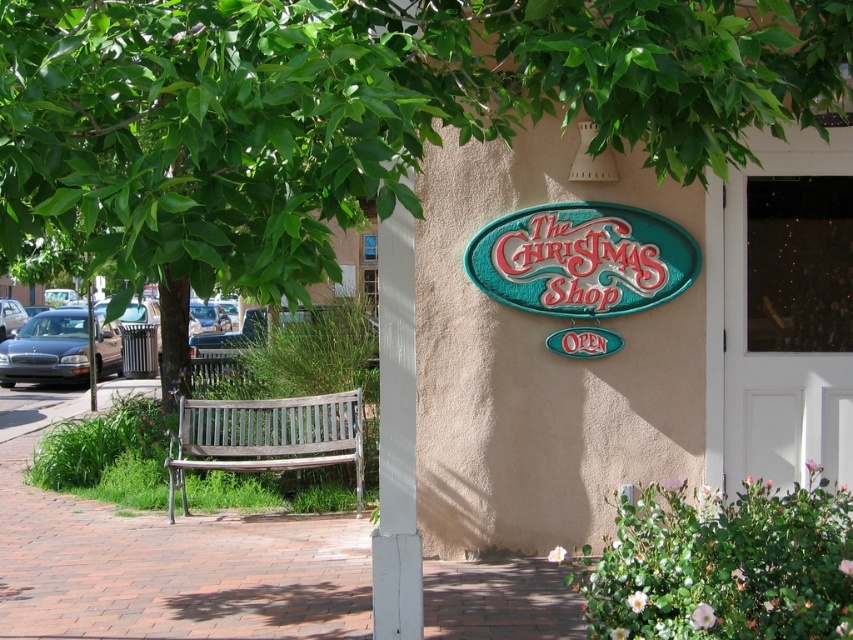
Question: Is white wooden door at right smaller than matte dark gray sedan at left?

Choices:
 (A) no
 (B) yes

Answer: (B)

Question: Which object is positioned closest to the matte dark gray sedan at left?

Choices:
 (A) green leafy tree at upper left
 (B) teal glossy sign at center
 (C) white wooden door at right
 (D) wooden bench at center

Answer: (D)

Question: Which point is farther to the camera?

Choices:
 (A) (318, 436)
 (B) (74, 360)

Answer: (B)

Question: Does wooden bench at center appear on the left side of matte dark gray sedan at left?

Choices:
 (A) no
 (B) yes

Answer: (A)

Question: Which object is farther from the camera taking this photo?

Choices:
 (A) green leafy tree at upper left
 (B) white wooden door at right
 (C) matte dark gray sedan at left
 (D) teal glossy sign at center

Answer: (C)

Question: Does green leafy tree at upper left appear on the left side of teal glossy sign at center?

Choices:
 (A) yes
 (B) no

Answer: (A)